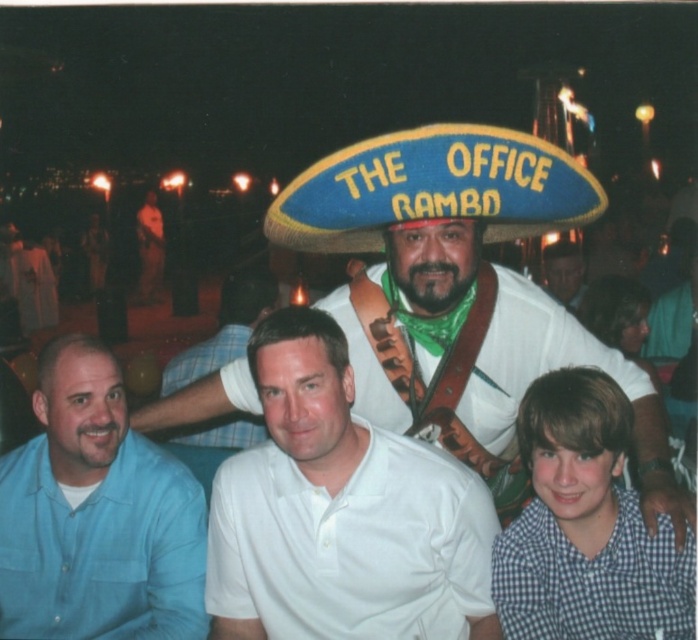
In the nighttime scene with the central figure in a sombrero, there are two shirts visible. The first is a blue cotton shirt at left and the second is a checkered fabric shirt at lower right. Which shirt is positioned more to the left side of the image?

The blue cotton shirt at left is positioned more to the left side of the image than the checkered fabric shirt at lower right.